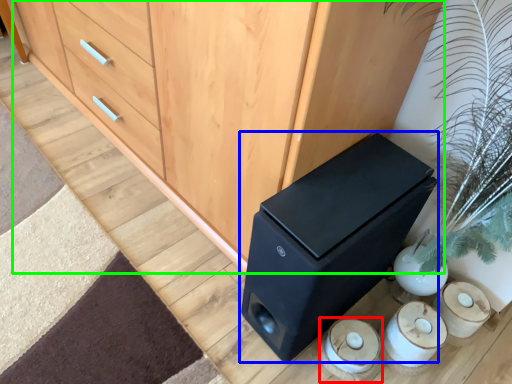
Question: Which object is the farthest from candle holder (highlighted by a red box)? Choose among these: furniture (highlighted by a blue box) or chest of drawers (highlighted by a green box).

Choices:
 (A) furniture
 (B) chest of drawers

Answer: (B)